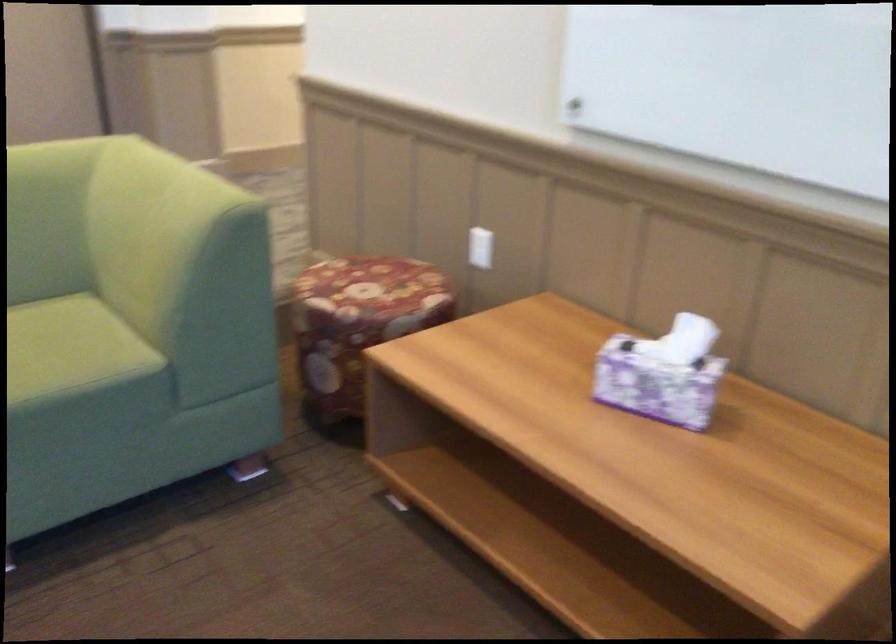
Identify the location of white tissue paper. The height and width of the screenshot is (644, 896). (690, 341).